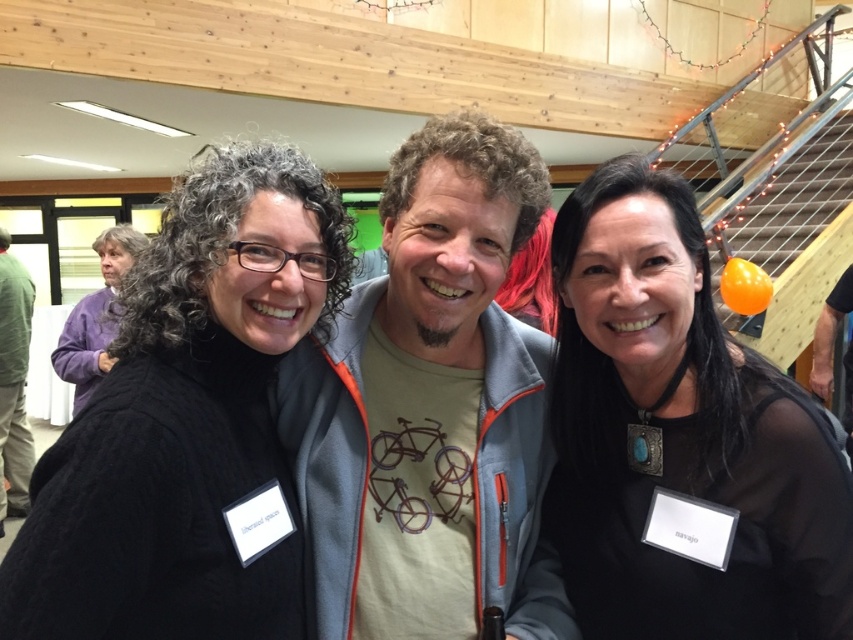
Question: Can you confirm if matte gray jacket at center is smaller than black mesh top at right?

Choices:
 (A) yes
 (B) no

Answer: (B)

Question: Can you confirm if matte gray jacket at center is smaller than black mesh top at right?

Choices:
 (A) yes
 (B) no

Answer: (B)

Question: Which point is closer to the camera?

Choices:
 (A) green cotton shirt at left
 (B) black cable-knit sweater at center
 (C) black mesh top at right
 (D) matte gray jacket at center

Answer: (B)

Question: Based on their relative distances, which object is nearer to the black cable-knit sweater at center?

Choices:
 (A) green cotton shirt at left
 (B) matte gray jacket at center

Answer: (B)

Question: Does black cable-knit sweater at center appear on the right side of green cotton shirt at left?

Choices:
 (A) yes
 (B) no

Answer: (A)

Question: Which point is closer to the camera?

Choices:
 (A) (527, 620)
 (B) (227, 177)
 (C) (28, 289)
 (D) (619, 163)

Answer: (B)